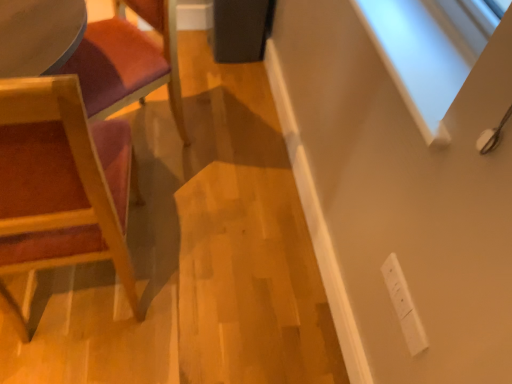
What are the coordinates of `vacant space to the right of wooden chair at left, arranged as the 1th chair when ordered from the bottom` in the screenshot? It's located at (204, 277).